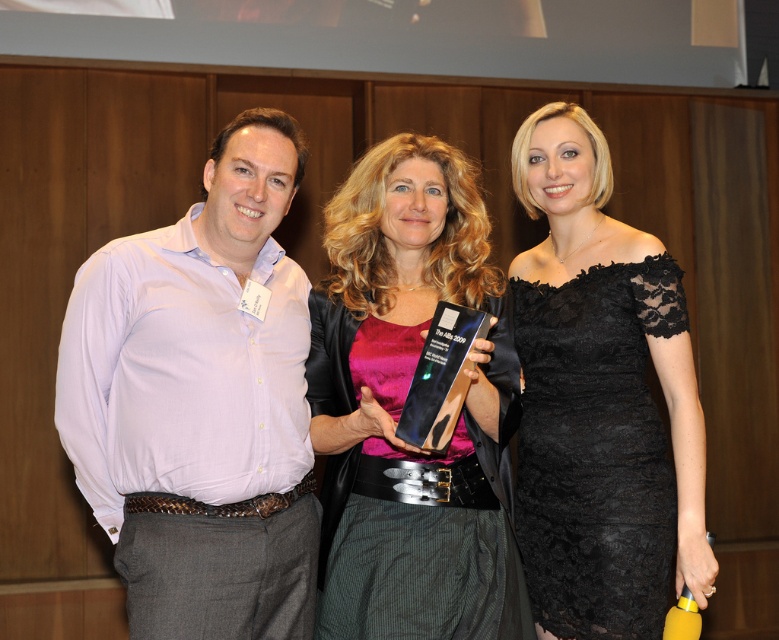
You are a photographer standing at the camera position. You need to adjust the focus to capture the pink velvet dress at center clearly. What is the minimum distance you should set the focus to ensure the dress is in sharp detail?

The minimum focus distance should be set to 5.74 feet to ensure the pink velvet dress at center is in sharp detail.

You are a photographer at the event and need to adjust the lighting to ensure both the linen shirt at left and the black lace dress at center are well lit. Based on their positions, which object should you focus the light on first?

The linen shirt at left is located below the black lace dress at center, so you should focus the light on the black lace dress at center first to ensure it is properly illuminated before adjusting for the lower positioned linen shirt at left.